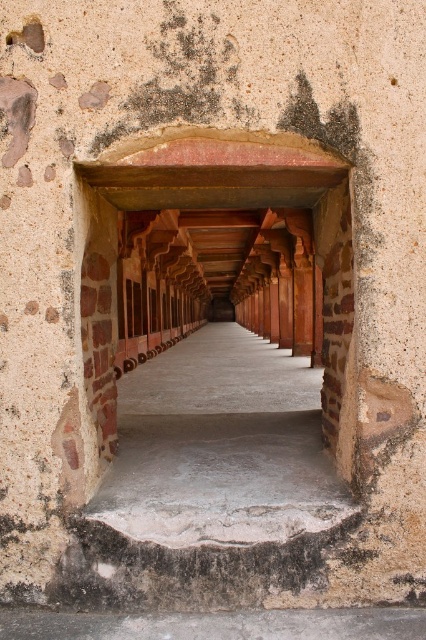
Question: Which point is farther to the camera?

Choices:
 (A) rusty metal hole at upper left
 (B) smooth concrete corridor at center

Answer: (A)

Question: Does smooth concrete corridor at center have a greater width compared to rusty metal hole at upper left?

Choices:
 (A) no
 (B) yes

Answer: (B)

Question: Where is smooth concrete corridor at center located in relation to rusty metal hole at upper left in the image?

Choices:
 (A) left
 (B) right

Answer: (B)

Question: Among these points, which one is farthest from the camera?

Choices:
 (A) (28, 29)
 (B) (111, 483)

Answer: (B)

Question: Which point appears closest to the camera in this image?

Choices:
 (A) [34, 22]
 (B) [290, 476]

Answer: (A)

Question: Can you confirm if smooth concrete corridor at center is positioned to the left of rusty metal hole at upper left?

Choices:
 (A) no
 (B) yes

Answer: (A)